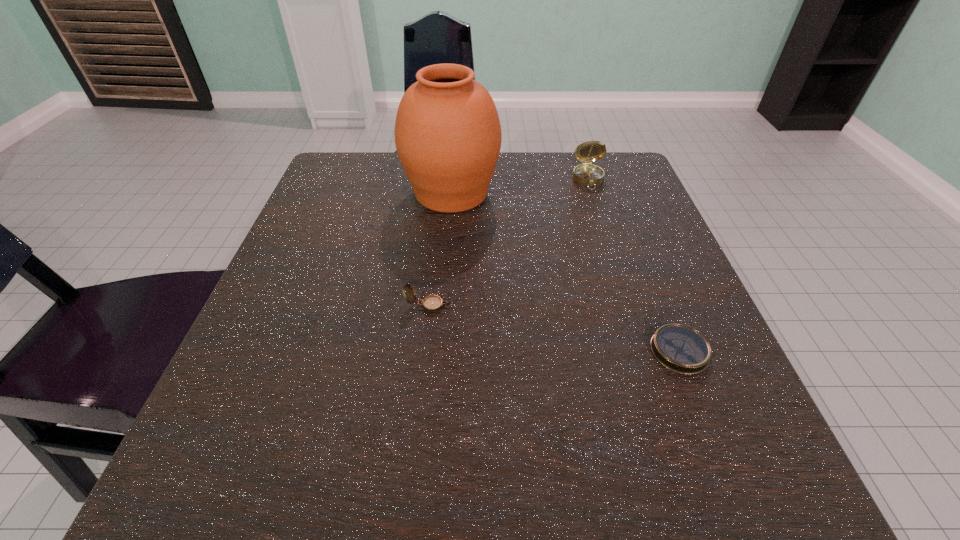
The width and height of the screenshot is (960, 540). In order to click on vacant space in between the leftmost compass and the shortest compass in this screenshot , I will do `click(554, 328)`.

Find the location of a particular element. Image resolution: width=960 pixels, height=540 pixels. unoccupied position between the urn and the shortest object is located at coordinates (565, 272).

Where is `empty space between the third shortest object and the second nearest object`? empty space between the third shortest object and the second nearest object is located at coordinates (509, 242).

Find the location of a particular element. unoccupied position between the second shortest object and the second tallest object is located at coordinates (509, 242).

Identify the location of empty space between the urn and the nearest compass. This screenshot has width=960, height=540. (565, 272).

In order to click on unoccupied area between the nearest compass and the third tallest object in this screenshot , I will do `click(554, 328)`.

In order to click on empty location between the nearest compass and the second nearest compass in this screenshot , I will do `click(554, 328)`.

The height and width of the screenshot is (540, 960). What are the coordinates of `unoccupied area between the second tallest compass and the urn` in the screenshot? It's located at (440, 249).

Where is `free spot between the tallest compass and the nearest compass`? free spot between the tallest compass and the nearest compass is located at coordinates (634, 265).

Identify which object is the third closest to the nearest object. Please provide its 2D coordinates. Your answer should be formatted as a tuple, i.e. [(x, y)], where the tuple contains the x and y coordinates of a point satisfying the conditions above.

[(586, 174)]